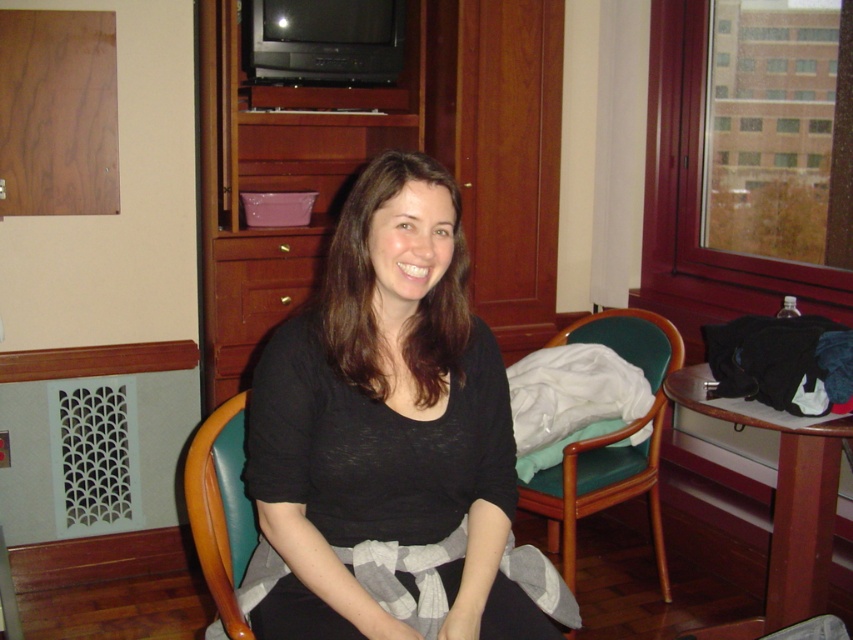
Which is behind, point (534, 90) or point (279, 307)?

Point (534, 90)

Identify the location of wooden dresser at center. This screenshot has height=640, width=853. (376, 152).

Can you confirm if black matte shirt at center is smaller than teal leather chair at center?

Correct, black matte shirt at center occupies less space than teal leather chair at center.

I want to click on black matte shirt at center, so click(386, 422).

Who is taller, black matte shirt at center or wooden dresser at center?

wooden dresser at center

In the scene shown: Does black matte shirt at center appear over wooden dresser at center?

No.

Is point (425, 342) more distant than point (248, 276)?

No, (425, 342) is closer to viewer.

Where is `black matte shirt at center`? This screenshot has height=640, width=853. black matte shirt at center is located at coordinates (386, 422).